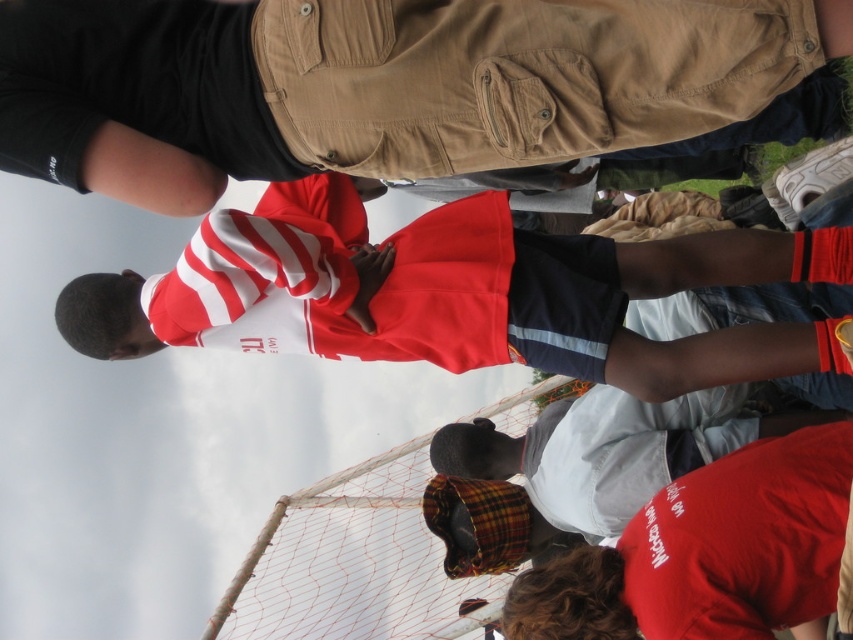
Question: Which point is closer to the camera taking this photo?

Choices:
 (A) (596, 260)
 (B) (445, 150)

Answer: (B)

Question: Does matte khaki cargo pants at center lie behind red and white striped shirt at center?

Choices:
 (A) yes
 (B) no

Answer: (B)

Question: Does matte khaki cargo pants at center have a smaller size compared to red and white striped shirt at center?

Choices:
 (A) no
 (B) yes

Answer: (B)

Question: Which point is farther to the camera?

Choices:
 (A) (119, 168)
 (B) (671, 240)

Answer: (B)

Question: Does matte khaki cargo pants at center have a smaller size compared to red and white striped shirt at center?

Choices:
 (A) no
 (B) yes

Answer: (B)